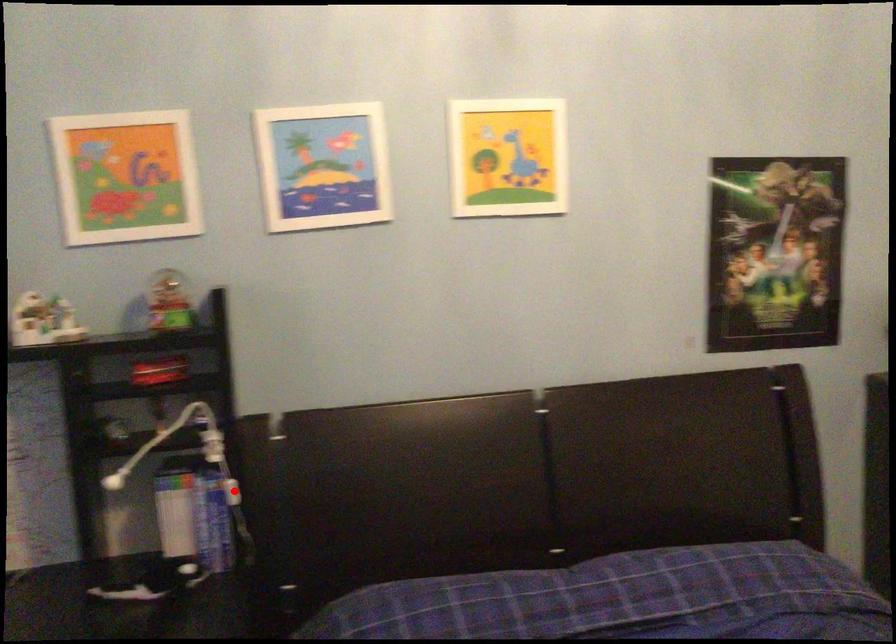
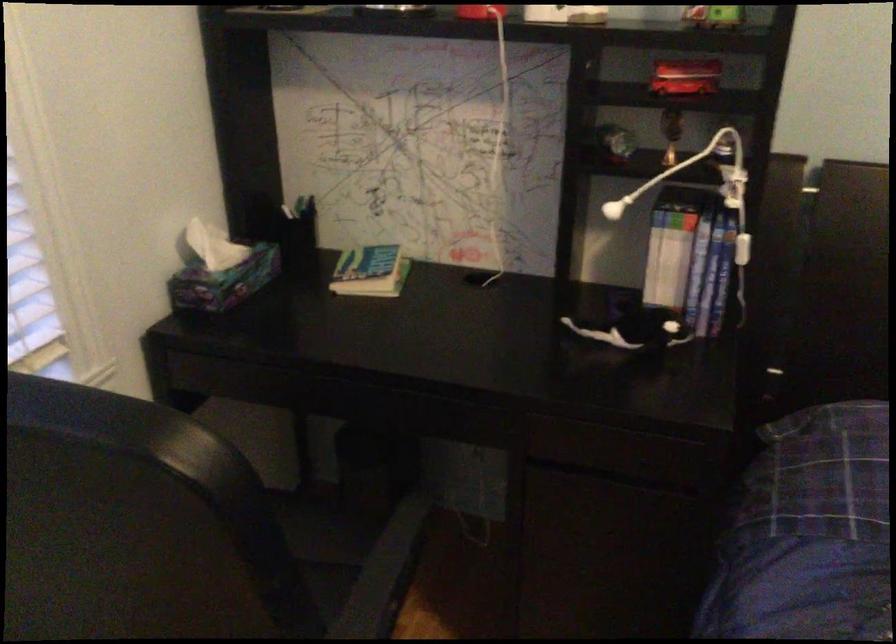
Locate, in the second image, the point that corresponds to the highlighted location in the first image.

(742, 249)